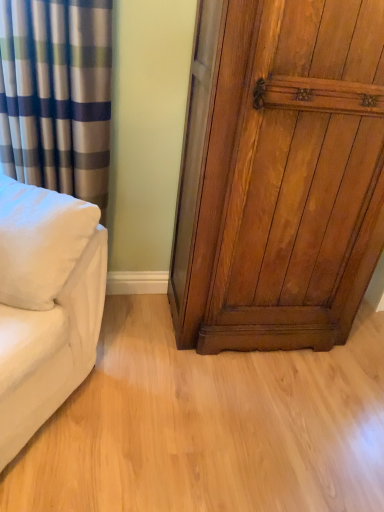
Identify the location of vacant space to the right of silky blue-green striped curtain at left. The image size is (384, 512). (135, 329).